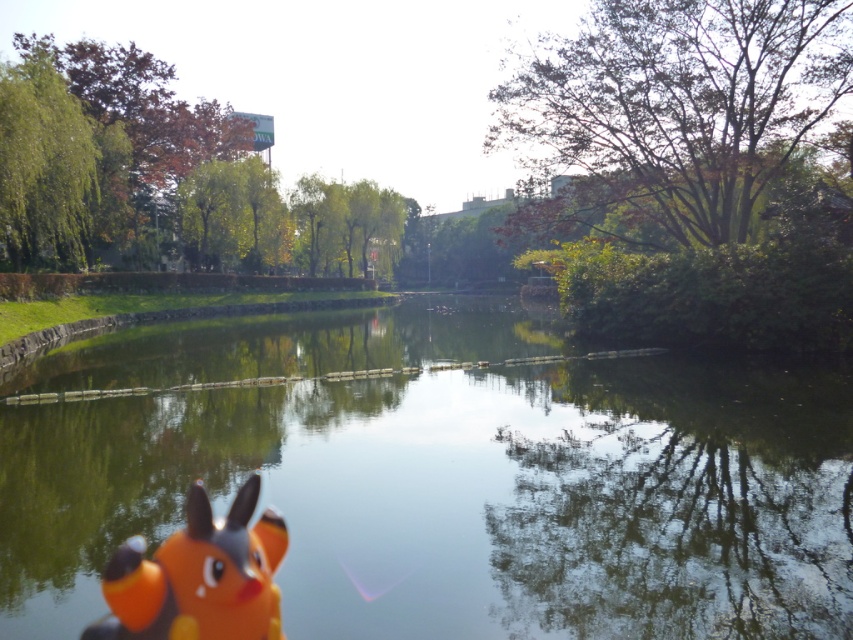
You are a photographer standing at the edge of the water in the park scene. You notice a point marked at coordinates (675, 109). Which object in the scene does this point belong to?

The point at coordinates (675, 109) is on the green leafy tree at upper right.

You are a photographer who wants to capture the reflection of the green glossy water at center in your shot. Where should you position your camera to ensure the reflection is centered in the frame?

To center the reflection of the green glossy water at center in the frame, position your camera directly above the point at coordinates approximately (467, 499), which is where the water is located.

You are standing in the park and see the green leafy tree at upper right. If you walk straight towards it, how far will you have to walk to reach it?

The green leafy tree at upper right is 23.07 meters away from you, so you will have to walk 23.07 meters to reach it.